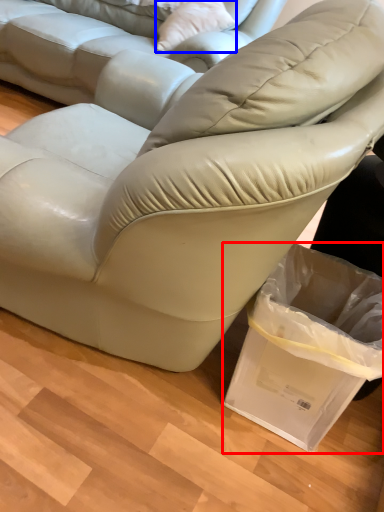
Question: Which object is closer to the camera taking this photo, shopping bag (highlighted by a red box) or throw pillow (highlighted by a blue box)?

Choices:
 (A) shopping bag
 (B) throw pillow

Answer: (A)